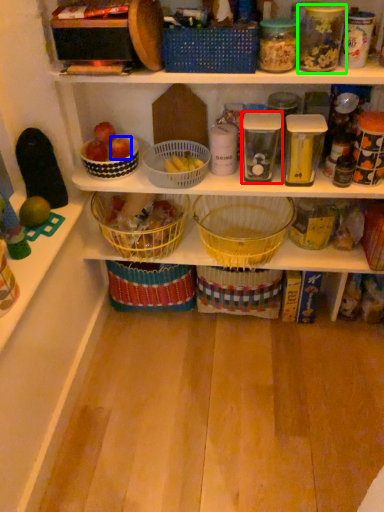
Question: Considering the real-world distances, which object is closest to glass jar (highlighted by a red box)? apple (highlighted by a blue box) or glass jar (highlighted by a green box).

Choices:
 (A) apple
 (B) glass jar

Answer: (B)